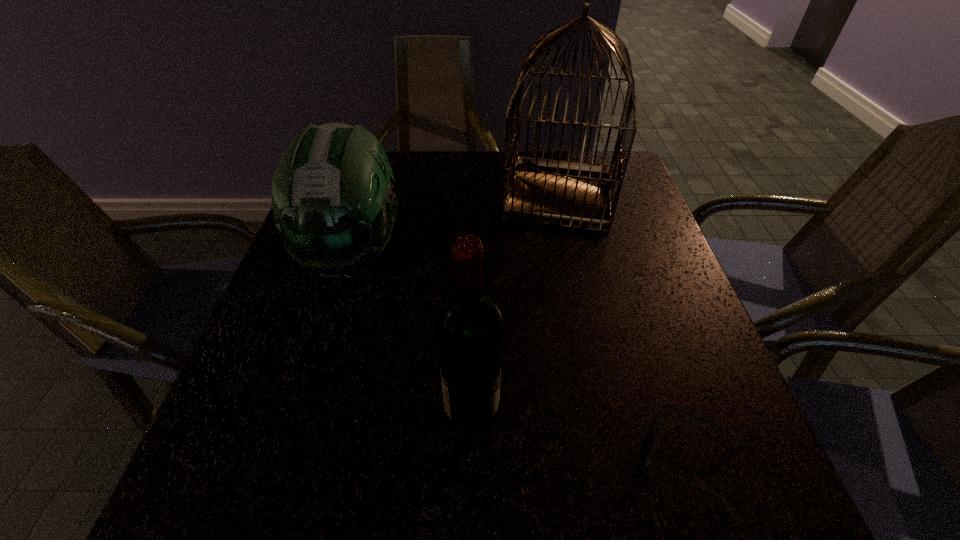
Find the location of a particular element. This screenshot has height=540, width=960. vacant space that's between the sunglasses and the second tallest object is located at coordinates (581, 434).

Identify the location of free space between the third object from right to left and the third tallest object. The image size is (960, 540). (413, 332).

Where is `vacant area that lies between the second shortest object and the birdcage`? This screenshot has height=540, width=960. vacant area that lies between the second shortest object and the birdcage is located at coordinates (456, 225).

Where is `empty space that is in between the birdcage and the sunglasses`? The width and height of the screenshot is (960, 540). empty space that is in between the birdcage and the sunglasses is located at coordinates (625, 327).

The image size is (960, 540). In order to click on object that is the third closest to the tallest object in this screenshot , I will do `click(659, 420)`.

Find the location of `object that ranks as the second closest to the tallest object`. object that ranks as the second closest to the tallest object is located at coordinates (469, 325).

Where is `vacant area in the image that satisfies the following two spatial constraints: 1. on the front side of the tallest object; 2. on the front and back of the second tallest object`? The width and height of the screenshot is (960, 540). vacant area in the image that satisfies the following two spatial constraints: 1. on the front side of the tallest object; 2. on the front and back of the second tallest object is located at coordinates [606, 409].

At what (x,y) coordinates should I click in order to perform the action: click on free point that satisfies the following two spatial constraints: 1. on the front side of the tallest object; 2. on the front and back of the second tallest object. Please return your answer as a coordinate pair (x, y). The image size is (960, 540). Looking at the image, I should click on (606, 409).